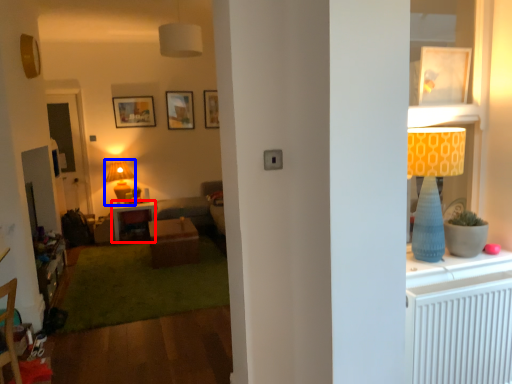
Question: Which object is further to the camera taking this photo, desk (highlighted by a red box) or lamp (highlighted by a blue box)?

Choices:
 (A) desk
 (B) lamp

Answer: (B)